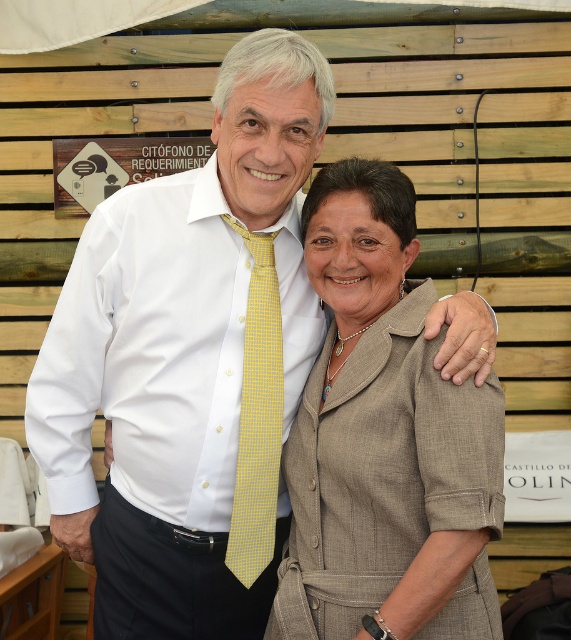
You are an interior designer assessing the placement of the matte beige suit at center in a room with wooden slats as the backdrop. Based on the coordinates provided, can you determine if the suit is positioned near the center of the room or closer to one of the edges?

The coordinates of the matte beige suit at center are at point (384, 440). Since both coordinates are greater than 0.5, this indicates the suit is positioned closer to the right and upper edges of the room rather than the center.

You are a photographer adjusting the lighting for a portrait. You notice the matte beige suit at center and the yellow checkered tie at center. Which object should you focus on first to ensure proper exposure, the one closer to the camera or the one further away?

The matte beige suit at center is in front of the yellow checkered tie at center, so you should focus on the matte beige suit at center first since it is closer to the camera and requires proper exposure before adjusting for the one behind.

You are a photographer planning to adjust the lighting for a photo shoot. You notice the matte beige suit at center and the yellow checkered tie at center in the image. Which object should you focus the spotlight on to highlight the one that is on the left side?

The yellow checkered tie at center is on the left side of the matte beige suit at center, so you should focus the spotlight on the yellow checkered tie at center.